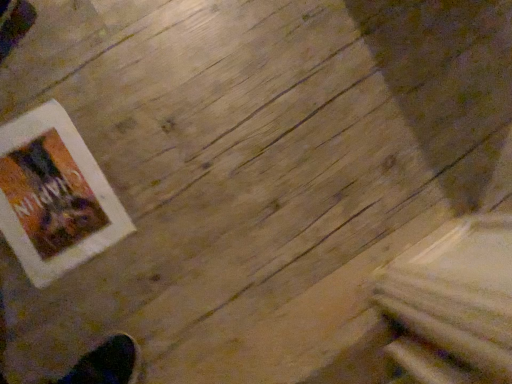
This screenshot has width=512, height=384. In order to click on white matte picture frame at lower left in this screenshot , I will do `click(54, 196)`.

Describe the element at coordinates (54, 196) in the screenshot. I see `white matte picture frame at lower left` at that location.

Where is `white matte picture frame at lower left`? This screenshot has width=512, height=384. white matte picture frame at lower left is located at coordinates click(x=54, y=196).